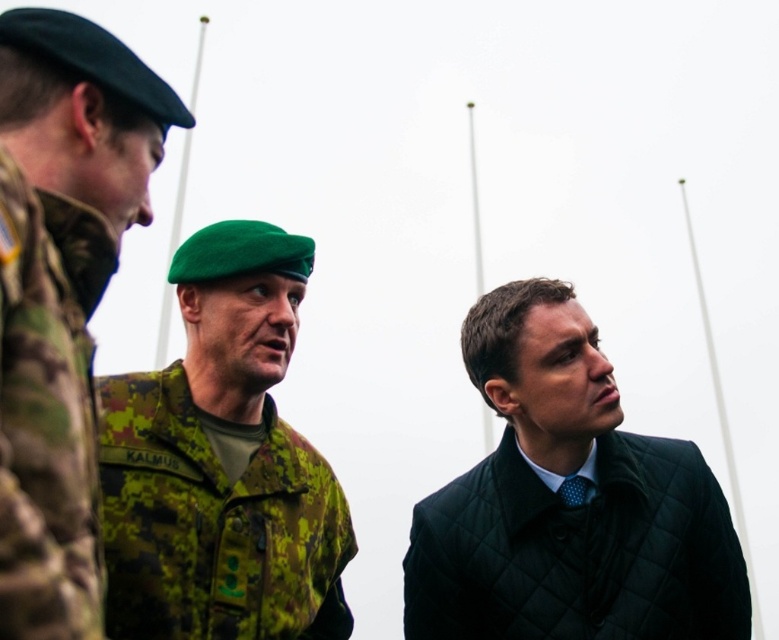
The width and height of the screenshot is (779, 640). What do you see at coordinates (221, 461) in the screenshot?
I see `camouflage fabric uniform at center` at bounding box center [221, 461].

Is camouflage fabric uniform at center bigger than camo fabric uniform at left?

No, camouflage fabric uniform at center is not bigger than camo fabric uniform at left.

Between point (214, 266) and point (93, 396), which one is positioned in front?

Positioned in front is point (93, 396).

The image size is (779, 640). In order to click on camouflage fabric uniform at center in this screenshot , I will do `click(221, 461)`.

In the scene shown: Is quilted dark green coat at center positioned in front of camouflage fabric uniform at center?

Yes.

Between quilted dark green coat at center and camouflage fabric uniform at center, which one is positioned higher?

quilted dark green coat at center is above.

Is point (531, 580) farther from viewer compared to point (101, 465)?

Yes, it is behind point (101, 465).

You are a GUI agent. You are given a task and a screenshot of the screen. Output one action in this format:
    pyautogui.click(x=<x>, y=<y>)
    Task: Click on the quilted dark green coat at center
    The image size is (779, 640).
    Given the screenshot: What is the action you would take?
    pyautogui.click(x=568, y=500)

In the scene shown: Can you confirm if quilted dark green coat at center is positioned below camo fabric uniform at left?

Indeed, quilted dark green coat at center is positioned under camo fabric uniform at left.

Is quilted dark green coat at center wider than camo fabric uniform at left?

No.

You are a GUI agent. You are given a task and a screenshot of the screen. Output one action in this format:
    pyautogui.click(x=<x>, y=<y>)
    Task: Click on the quilted dark green coat at center
    Image resolution: width=779 pixels, height=640 pixels.
    Given the screenshot: What is the action you would take?
    click(568, 500)

Find the location of `quilted dark green coat at center`. quilted dark green coat at center is located at coordinates (x=568, y=500).